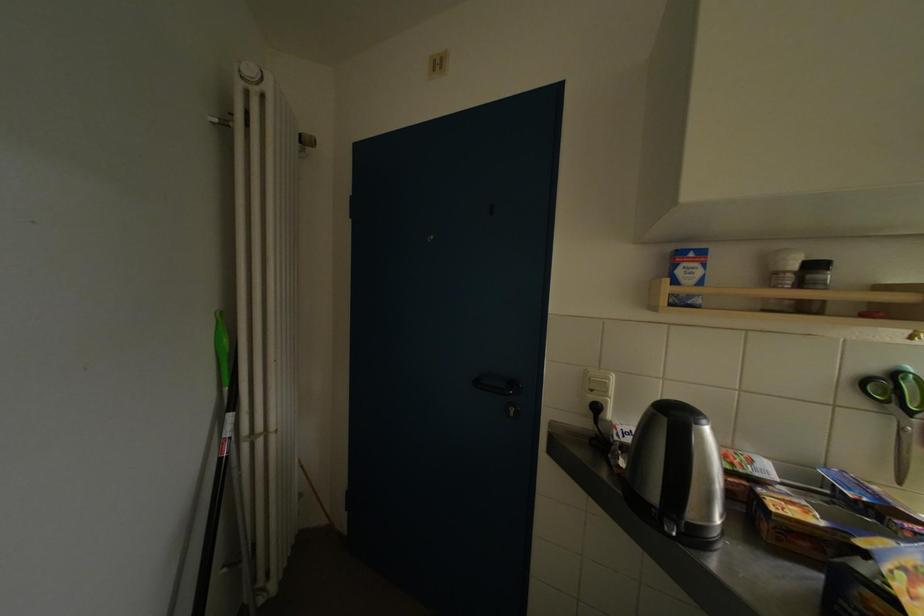
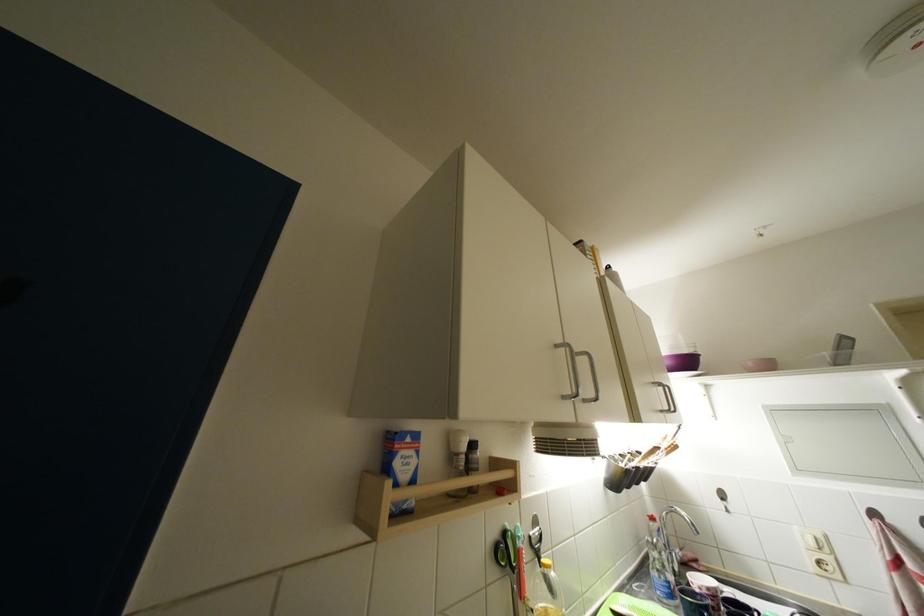
The first image is from the beginning of the video and the second image is from the end. How did the camera likely rotate when shooting the video?

The camera rotated toward right-up.